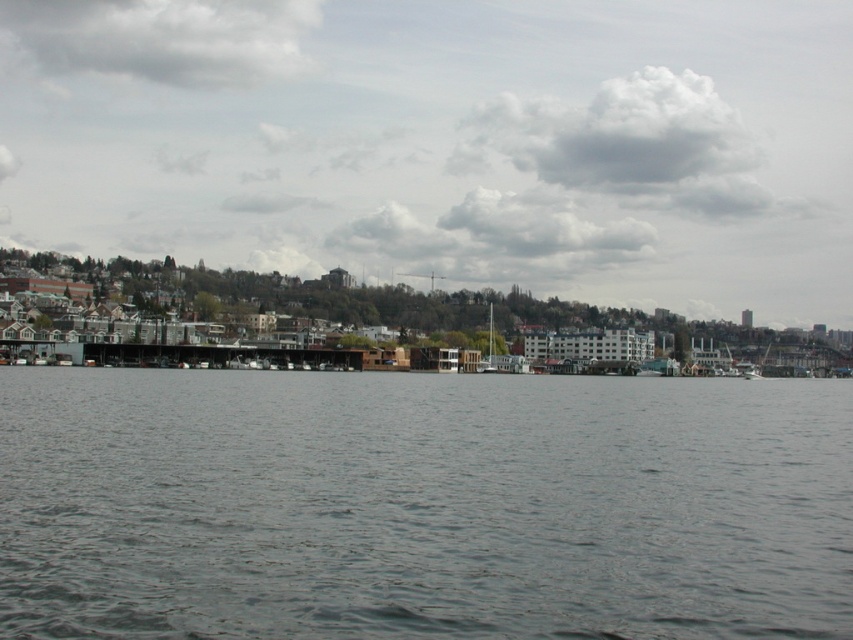
Between gray water at center and brown wooden dock at center, which one appears on the right side from the viewer's perspective?

Positioned to the right is gray water at center.

Does point (193, 624) come behind point (113, 353)?

No, (193, 624) is closer to viewer.

Find the location of a particular element. The image size is (853, 640). gray water at center is located at coordinates (421, 506).

Does brown wooden dock at center have a greater width compared to white plastic boat at center?

Yes, brown wooden dock at center is wider than white plastic boat at center.

Between point (344, 352) and point (518, 355), which one is positioned behind?

Point (518, 355)

At what (x,y) coordinates should I click in order to perform the action: click on brown wooden dock at center. Please return your answer as a coordinate pair (x, y). The width and height of the screenshot is (853, 640). Looking at the image, I should click on (215, 355).

Does gray water at center have a greater width compared to white plastic boat at center?

Yes.

In the scene shown: Is gray water at center to the right of white plastic boat at center from the viewer's perspective?

Incorrect, gray water at center is not on the right side of white plastic boat at center.

What do you see at coordinates (421, 506) in the screenshot? This screenshot has height=640, width=853. I see `gray water at center` at bounding box center [421, 506].

You are a GUI agent. You are given a task and a screenshot of the screen. Output one action in this format:
    pyautogui.click(x=<x>, y=<y>)
    Task: Click on the gray water at center
    The image size is (853, 640).
    Given the screenshot: What is the action you would take?
    [421, 506]